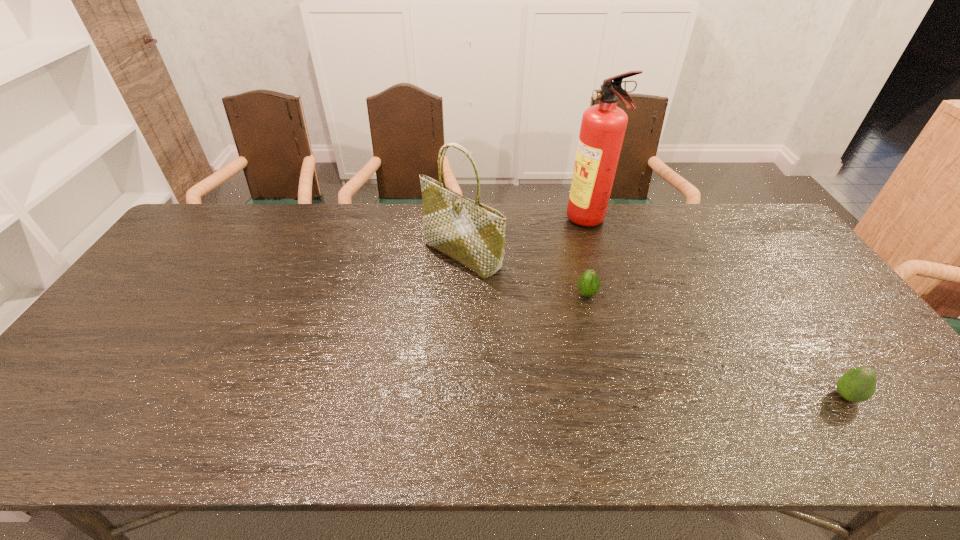
You are a GUI agent. You are given a task and a screenshot of the screen. Output one action in this format:
    pyautogui.click(x=<x>, y=<y>)
    Task: Click on the tallest object
    Image resolution: width=960 pixels, height=540 pixels.
    Given the screenshot: What is the action you would take?
    pyautogui.click(x=603, y=126)

Find the location of a particular element. The image size is (960, 540). the leftmost object is located at coordinates (473, 234).

The width and height of the screenshot is (960, 540). I want to click on the third shortest object, so click(x=473, y=234).

Find the location of a particular element. the rightmost object is located at coordinates (858, 384).

The width and height of the screenshot is (960, 540). In order to click on the nearest object in this screenshot , I will do `click(858, 384)`.

Identify the location of the second nearest object. The image size is (960, 540). (588, 284).

Image resolution: width=960 pixels, height=540 pixels. Identify the location of the farther avocado. (588, 284).

Locate an element on the screen. free space located 0.360m on the front-facing side of the tallest object is located at coordinates (464, 222).

The width and height of the screenshot is (960, 540). Find the location of `vacant space situated 0.170m on the front-facing side of the tallest object`. vacant space situated 0.170m on the front-facing side of the tallest object is located at coordinates (518, 222).

Where is `vacant space located on the front-facing side of the tallest object`? vacant space located on the front-facing side of the tallest object is located at coordinates (553, 222).